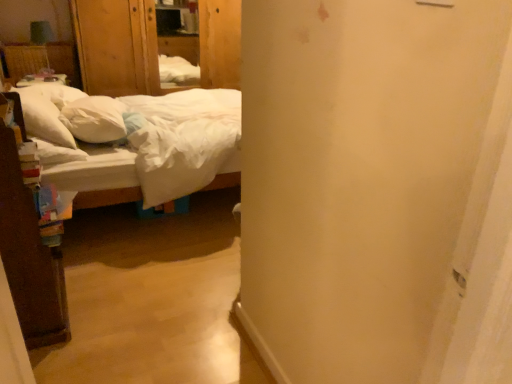
Image resolution: width=512 pixels, height=384 pixels. I want to click on white soft pillow at left, the 2th pillow in the left-to-right sequence, so click(95, 119).

Identify the location of white soft pillow at left, the 1th pillow when ordered from left to right. (42, 118).

Locate an element on the screen. white cotton bed at left is located at coordinates (91, 170).

Consider the image. Is white soft pillow at left, the 2th pillow in the left-to-right sequence, inside or outside of wooden armoire at upper left?

white soft pillow at left, the 2th pillow in the left-to-right sequence, is spatially situated outside wooden armoire at upper left.

From the image's perspective, which object appears higher, white soft pillow at left, which appears as the 1th pillow when viewed from the right, or wooden armoire at upper left?

wooden armoire at upper left appears higher in the image.

Is white soft pillow at left, the 2th pillow in the left-to-right sequence, in front of wooden armoire at upper left?

Yes, white soft pillow at left, the 2th pillow in the left-to-right sequence, is closer to the viewer.

You are a GUI agent. You are given a task and a screenshot of the screen. Output one action in this format:
    pyautogui.click(x=<x>, y=<y>)
    Task: Click on the pillow on the right of white soft pillow at left, the 1th pillow when ordered from left to right
    
    Given the screenshot: What is the action you would take?
    pyautogui.click(x=95, y=119)

Can you confirm if white soft pillow at left, which appears as the 1th pillow when viewed from the right, is positioned to the right of white soft pillow at left, positioned as the second pillow in right-to-left order?

Yes.

Is white soft pillow at left, which appears as the 1th pillow when viewed from the right, directly adjacent to white soft pillow at left, the 1th pillow when ordered from left to right?

No, white soft pillow at left, which appears as the 1th pillow when viewed from the right, is not making contact with white soft pillow at left, the 1th pillow when ordered from left to right.

Could you measure the distance between white soft pillow at left, the 2th pillow in the left-to-right sequence, and white soft pillow at left, the 1th pillow when ordered from left to right?

7.18 inches.

Is wooden armoire at upper left inside or outside of white soft pillow at left, the 1th pillow when ordered from left to right?

The correct answer is: outside.

From the image's perspective, would you say wooden armoire at upper left is shown under white soft pillow at left, the 1th pillow when ordered from left to right?

No, from the image's perspective, wooden armoire at upper left is not beneath white soft pillow at left, the 1th pillow when ordered from left to right.

Is wooden armoire at upper left smaller than white soft pillow at left, positioned as the second pillow in right-to-left order?

No.

Find the location of `the 2nd pillow counting from the left of the wooden armoire at upper left`. the 2nd pillow counting from the left of the wooden armoire at upper left is located at coordinates pos(42,118).

Would you say white soft pillow at left, positioned as the second pillow in right-to-left order, is outside white soft pillow at left, which appears as the 1th pillow when viewed from the right?

Yes, white soft pillow at left, positioned as the second pillow in right-to-left order, is located beyond the bounds of white soft pillow at left, which appears as the 1th pillow when viewed from the right.

From the picture: Which object is further away from the camera, white soft pillow at left, the 1th pillow when ordered from left to right, or white soft pillow at left, which appears as the 1th pillow when viewed from the right?

white soft pillow at left, which appears as the 1th pillow when viewed from the right, is further from the camera.

Is point (21, 104) in front of point (82, 105)?

Yes, it is.

From a real-world perspective, who is located higher, white soft pillow at left, positioned as the second pillow in right-to-left order, or white soft pillow at left, the 2th pillow in the left-to-right sequence?

white soft pillow at left, positioned as the second pillow in right-to-left order, is physically above.

Is point (123, 156) in front of point (86, 131)?

Yes, point (123, 156) is closer to viewer.

Does white cotton bed at left have a smaller size compared to white soft pillow at left, the 2th pillow in the left-to-right sequence?

Incorrect, white cotton bed at left is not smaller in size than white soft pillow at left, the 2th pillow in the left-to-right sequence.

Based on the photo, from a real-world perspective, who is located higher, white cotton bed at left or white soft pillow at left, the 2th pillow in the left-to-right sequence?

white soft pillow at left, the 2th pillow in the left-to-right sequence, is physically above.

Considering the positions of points (153, 75) and (128, 159), is point (153, 75) closer to camera compared to point (128, 159)?

No, it is behind (128, 159).

How many degrees apart are the facing directions of wooden armoire at upper left and white cotton bed at left?

90.1 degrees separate the facing orientations of wooden armoire at upper left and white cotton bed at left.

Is wooden armoire at upper left bigger or smaller than white cotton bed at left?

Considering their sizes, wooden armoire at upper left takes up less space than white cotton bed at left.

Does wooden armoire at upper left have a lesser width compared to white cotton bed at left?

Yes.

Considering the relative sizes of white cotton bed at left and white soft pillow at left, positioned as the second pillow in right-to-left order, in the image provided, is white cotton bed at left shorter than white soft pillow at left, positioned as the second pillow in right-to-left order,?

No.

Where is `bed located below the white soft pillow at left, the 1th pillow when ordered from left to right (from the image's perspective)`? bed located below the white soft pillow at left, the 1th pillow when ordered from left to right (from the image's perspective) is located at coordinates (91, 170).

Is point (101, 171) farther from viewer compared to point (41, 104)?

Yes, it is.

Find the location of `the 2nd pillow directly beneath the wooden armoire at upper left (from a real-world perspective)`. the 2nd pillow directly beneath the wooden armoire at upper left (from a real-world perspective) is located at coordinates (95, 119).

Locate an element on the screen. pillow behind the white soft pillow at left, positioned as the second pillow in right-to-left order is located at coordinates (95, 119).

From the picture: Which object lies further to the anchor point wooden armoire at upper left, white soft pillow at left, the 1th pillow when ordered from left to right, or white soft pillow at left, which appears as the 1th pillow when viewed from the right?

The object further to wooden armoire at upper left is white soft pillow at left, the 1th pillow when ordered from left to right.

Looking at the image, which one is located further to wooden armoire at upper left, white soft pillow at left, which appears as the 1th pillow when viewed from the right, or white cotton bed at left?

white cotton bed at left lies further to wooden armoire at upper left than the other object.

Which object lies nearer to the anchor point white soft pillow at left, which appears as the 1th pillow when viewed from the right, white cotton bed at left or white soft pillow at left, the 1th pillow when ordered from left to right?

white soft pillow at left, the 1th pillow when ordered from left to right, lies closer to white soft pillow at left, which appears as the 1th pillow when viewed from the right, than the other object.

When comparing their distances from white soft pillow at left, positioned as the second pillow in right-to-left order, does white soft pillow at left, which appears as the 1th pillow when viewed from the right, or white cotton bed at left seem further?

white soft pillow at left, which appears as the 1th pillow when viewed from the right, lies further to white soft pillow at left, positioned as the second pillow in right-to-left order, than the other object.

Based on their spatial positions, is wooden armoire at upper left or white cotton bed at left further from white soft pillow at left, the 2th pillow in the left-to-right sequence?

Based on the image, wooden armoire at upper left appears to be further to white soft pillow at left, the 2th pillow in the left-to-right sequence.

When comparing their distances from white soft pillow at left, the 2th pillow in the left-to-right sequence, does white cotton bed at left or wooden armoire at upper left seem closer?

Among the two, white cotton bed at left is located nearer to white soft pillow at left, the 2th pillow in the left-to-right sequence.

When comparing their distances from white soft pillow at left, the 2th pillow in the left-to-right sequence, does white soft pillow at left, positioned as the second pillow in right-to-left order, or wooden armoire at upper left seem closer?

white soft pillow at left, positioned as the second pillow in right-to-left order, is closer to white soft pillow at left, the 2th pillow in the left-to-right sequence.

When comparing their distances from white cotton bed at left, does wooden armoire at upper left or white soft pillow at left, the 1th pillow when ordered from left to right, seem closer?

white soft pillow at left, the 1th pillow when ordered from left to right, is closer to white cotton bed at left.

Identify the location of pillow between white soft pillow at left, the 1th pillow when ordered from left to right, and wooden armoire at upper left, along the z-axis. The width and height of the screenshot is (512, 384). (95, 119).

Where is `pillow located between white soft pillow at left, the 1th pillow when ordered from left to right, and white cotton bed at left in the left-right direction`? The height and width of the screenshot is (384, 512). pillow located between white soft pillow at left, the 1th pillow when ordered from left to right, and white cotton bed at left in the left-right direction is located at coordinates (95, 119).